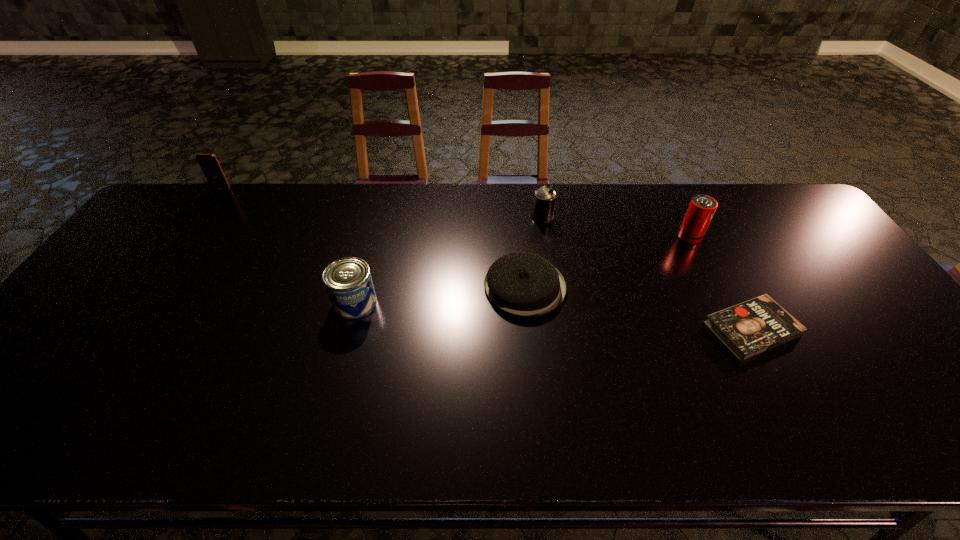
Where is `vacant area at the far edge`? vacant area at the far edge is located at coordinates (516, 201).

At what (x,y) coordinates should I click in order to perform the action: click on free space at the near edge. Please return your answer as a coordinate pair (x, y). The width and height of the screenshot is (960, 540). Looking at the image, I should click on (413, 422).

You are a GUI agent. You are given a task and a screenshot of the screen. Output one action in this format:
    pyautogui.click(x=<x>, y=<y>)
    Task: Click on the free spot at the left edge of the desktop
    The height and width of the screenshot is (540, 960).
    Given the screenshot: What is the action you would take?
    pyautogui.click(x=67, y=377)

Locate an element on the screen. This screenshot has width=960, height=540. free space at the right edge of the desktop is located at coordinates (906, 391).

This screenshot has height=540, width=960. I want to click on free region at the far left corner of the desktop, so click(x=152, y=219).

Identify the location of vacant region between the cellular telephone and the pancake. (373, 238).

Identify the location of free space between the leftmost object and the third farthest object. (456, 213).

Where is `empty space that is in between the book and the farthest object`? This screenshot has width=960, height=540. empty space that is in between the book and the farthest object is located at coordinates (487, 260).

In order to click on blank region between the shortest object and the cellular telephone in this screenshot , I will do [x=487, y=260].

At what (x,y) coordinates should I click in order to perform the action: click on vacant area that lies between the book and the second nearest can. Please return your answer as a coordinate pair (x, y). This screenshot has height=540, width=960. Looking at the image, I should click on (721, 283).